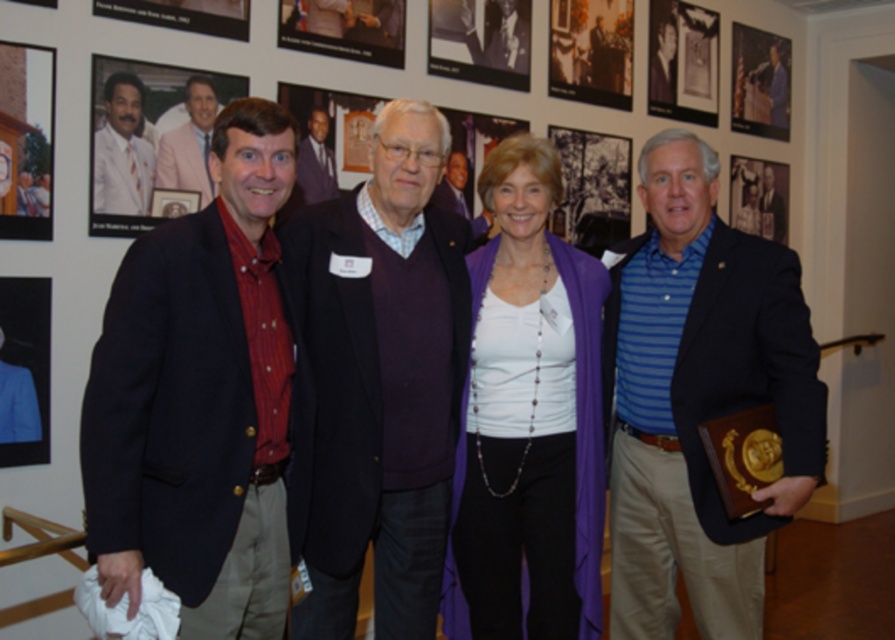
Question: Estimate the real-world distances between objects in this image. Which object is closer to the pink satin suit at upper left?

Choices:
 (A) matte black frame at left
 (B) wooden plaque at upper center
 (C) matte white shirt at upper left
 (D) blue striped shirt at right

Answer: (A)

Question: Is purple fabric at center behind matte white shirt at upper left?

Choices:
 (A) yes
 (B) no

Answer: (B)

Question: Can you confirm if wooden picture frame at upper left is positioned above pink satin suit at upper left?

Choices:
 (A) no
 (B) yes

Answer: (A)

Question: Which point is closer to the camera taking this photo?

Choices:
 (A) (173, 422)
 (B) (320, 45)
 (C) (1, 316)
 (D) (413, 634)

Answer: (A)

Question: Which point is farther to the camera?

Choices:
 (A) matte purple sweater at center
 (B) matte black frame at left
 (C) blue fabric at left
 (D) wooden picture frame at upper left

Answer: (A)

Question: Is blue striped shirt at right positioned in front of blue fabric at left?

Choices:
 (A) yes
 (B) no

Answer: (A)